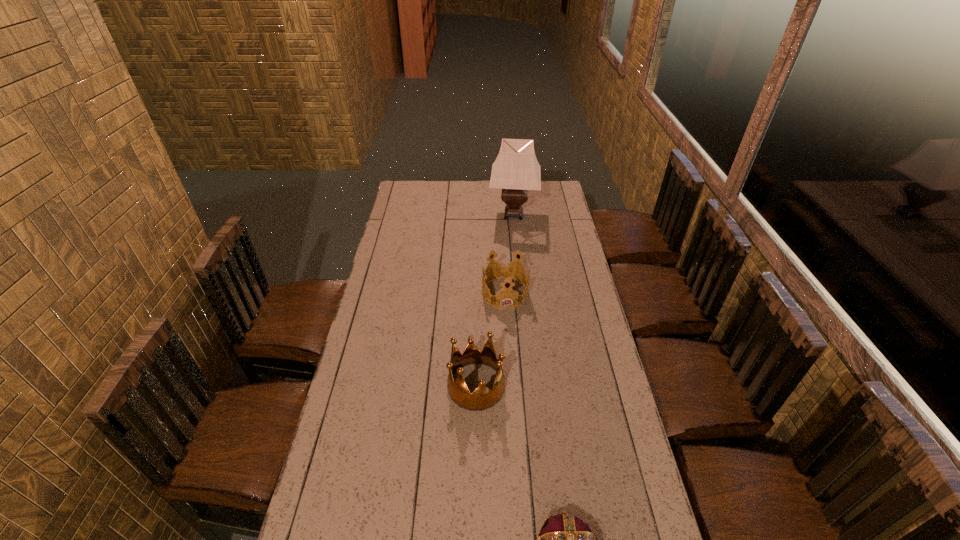
This screenshot has width=960, height=540. Identify the location of free space at the far edge of the desktop. click(x=483, y=194).

At what (x,y) coordinates should I click in order to perform the action: click on free region at the left edge of the desktop. Please return your answer as a coordinate pair (x, y). The image size is (960, 540). Looking at the image, I should click on click(x=396, y=325).

Locate an element on the screen. This screenshot has height=540, width=960. vacant space at the right edge of the desktop is located at coordinates (606, 357).

Identify the location of vacant space at the far left corner of the desktop. (413, 185).

Identify the location of object that is the second closest to the nearest crown. (505, 271).

Locate an element on the screen. the closest object to the shortest object is located at coordinates (482, 398).

Select which crown is the second closest to the second farthest object. Please provide its 2D coordinates. Your answer should be formatted as a tuple, i.e. [(x, y)], where the tuple contains the x and y coordinates of a point satisfying the conditions above.

[(565, 539)]

Locate an element on the screen. the closest crown to the second nearest crown is located at coordinates (505, 271).

The image size is (960, 540). I want to click on vacant space that satisfies the following two spatial constraints: 1. on the back side of the second farthest crown; 2. on the right side of the farthest object, so 477,214.